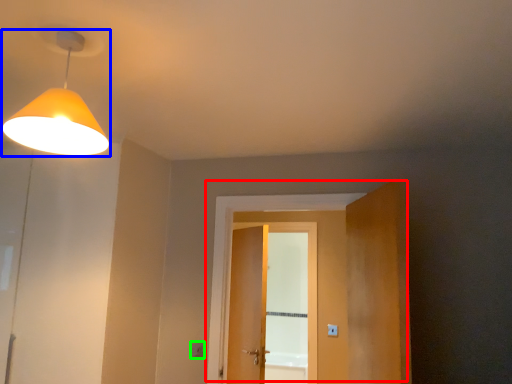
Question: Considering the real-world distances, which object is closest to door (highlighted by a red box)? lamp (highlighted by a blue box) or light switch (highlighted by a green box).

Choices:
 (A) lamp
 (B) light switch

Answer: (B)